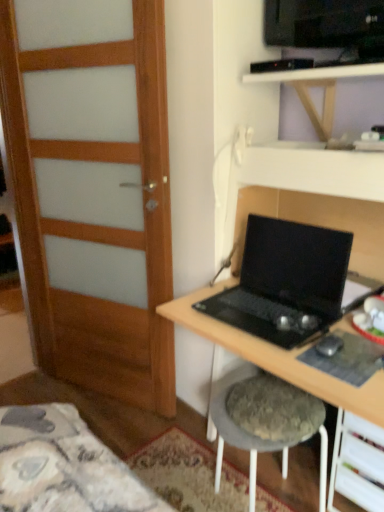
Image resolution: width=384 pixels, height=512 pixels. What are the coordinates of `free space that is to the left of fuzzy fabric stool at lower center` in the screenshot? It's located at pyautogui.click(x=175, y=474).